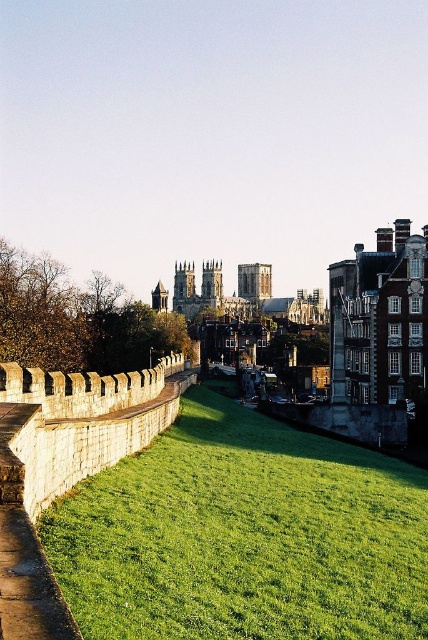
You are a landscape architect planning to plant flowers in the green grassy at center and smooth stone tower at center. Which area has more space available for planting?

The smooth stone tower at center has more space available for planting than the green grassy at center because the green grassy at center occupies less space than smooth stone tower at center.

You are standing at the base of the stone wall in the historic cityscape. You see two points marked in the image. Which point, point (398, 621) or point (208, 301), is closer to you?

Point (398, 621) is closer to the viewer than point (208, 301).